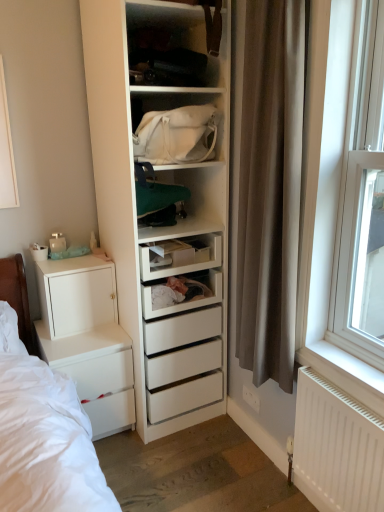
At what (x,y) coordinates should I click in order to perform the action: click on free spot below brown fabric curtain at right (from a real-world perspective). Please return your answer as a coordinate pair (x, y). Looking at the image, I should click on (245, 462).